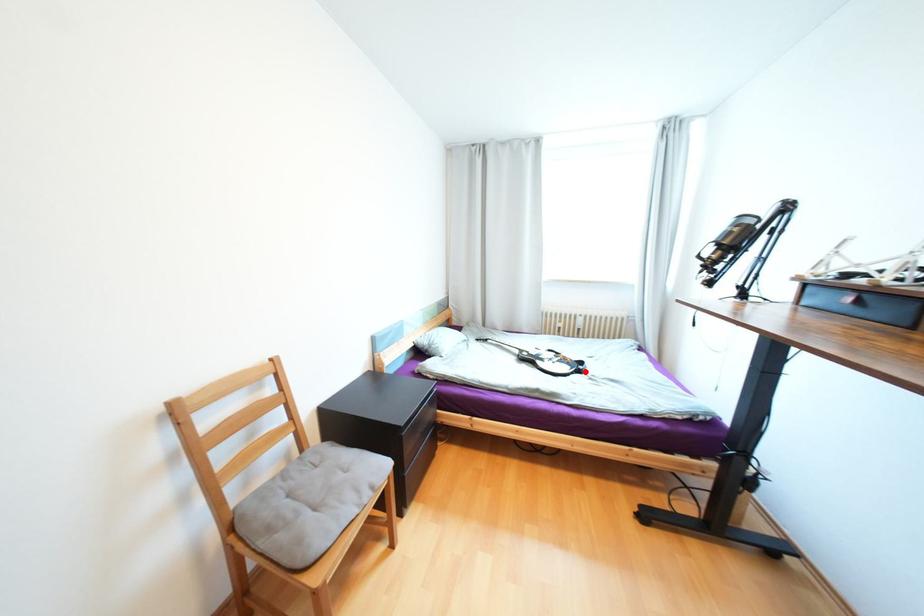
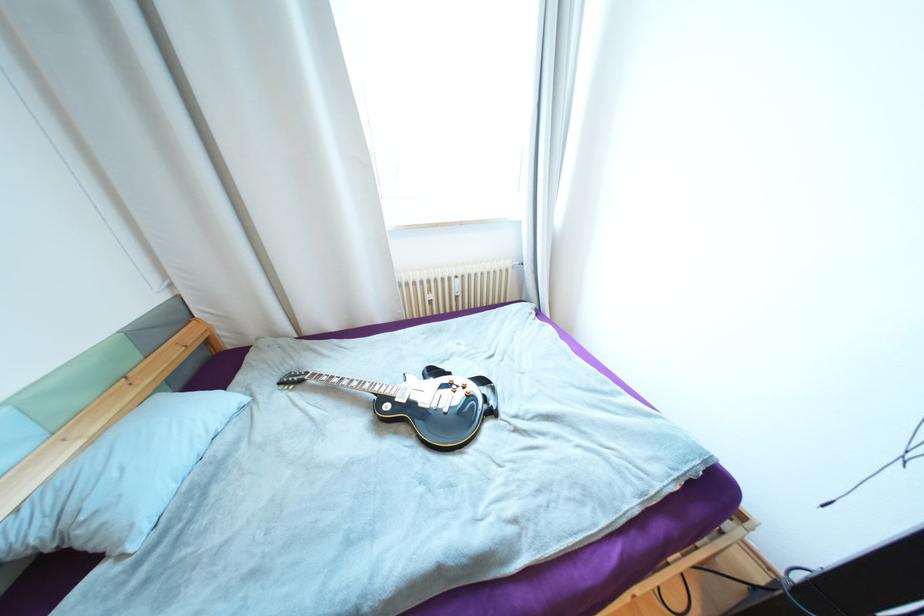
Question: I am providing you with two images of the same scene from different viewpoints. Given a red point in image1, look at the same physical point in image2. Is it:

Choices:
 (A) Closer to the viewpoint
 (B) Farther from the viewpoint

Answer: (A)